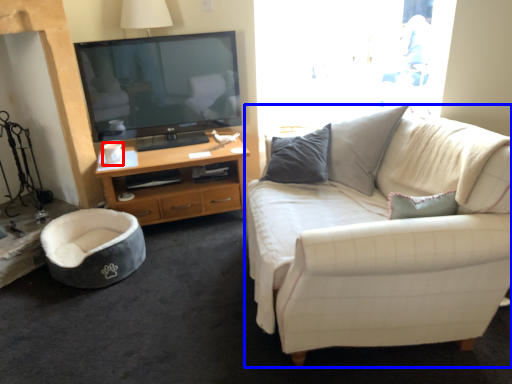
Question: Which object appears farthest to the camera in this image, coffee cup (highlighted by a red box) or studio couch (highlighted by a blue box)?

Choices:
 (A) coffee cup
 (B) studio couch

Answer: (A)